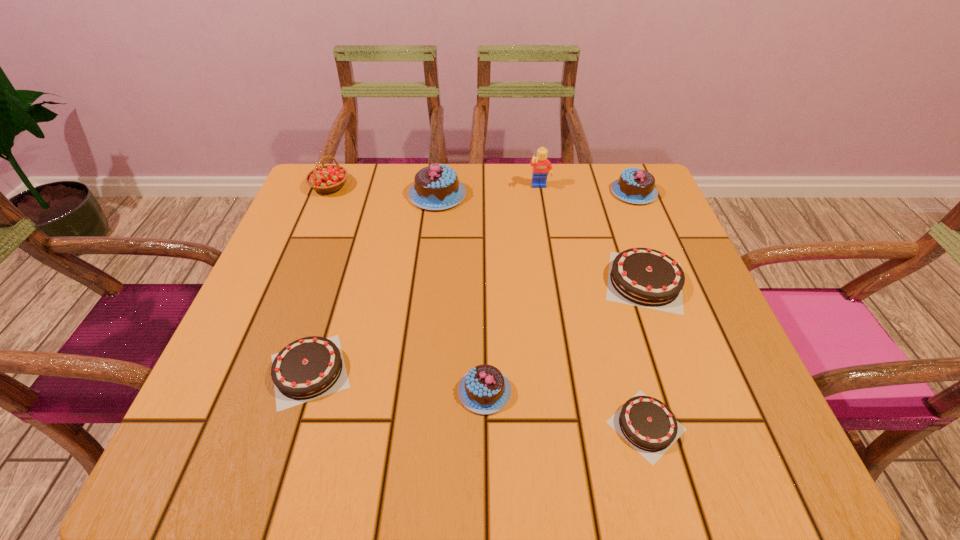
Where is `vacant region located on the back of the shortest chocolate cake`? The height and width of the screenshot is (540, 960). vacant region located on the back of the shortest chocolate cake is located at coordinates (628, 360).

Find the location of a particular element. This screenshot has height=540, width=960. Lego present at the far edge is located at coordinates (542, 167).

This screenshot has height=540, width=960. I want to click on strawberry positioned at the far edge, so click(x=329, y=178).

At what (x,y) coordinates should I click in order to perform the action: click on strawberry at the left edge. Please return your answer as a coordinate pair (x, y). This screenshot has width=960, height=540. Looking at the image, I should click on (329, 178).

Find the location of a particular element. chocolate cake at the left edge is located at coordinates (311, 367).

I want to click on object located at the far left corner, so click(329, 178).

What are the coordinates of `object positioned at the far right corner` in the screenshot? It's located at (637, 186).

This screenshot has width=960, height=540. What are the coordinates of `object positioned at the near right corner` in the screenshot? It's located at (646, 423).

Image resolution: width=960 pixels, height=540 pixels. In order to click on vacant space at the far edge in this screenshot , I will do `click(408, 174)`.

Find the location of `free location at the near edge`. free location at the near edge is located at coordinates (457, 429).